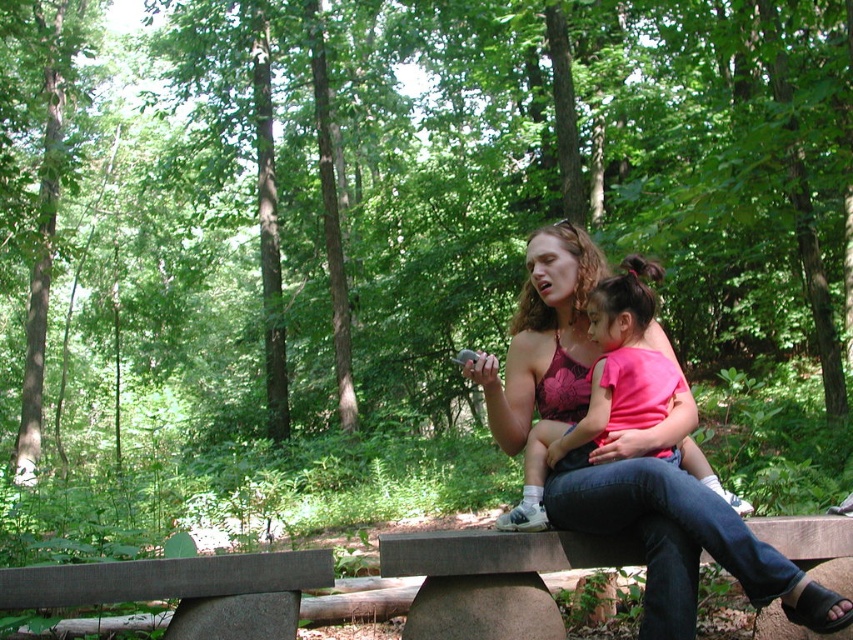
You are standing at the origin point in the image. Which direction should you move to reach the gray concrete bench at center?

The gray concrete bench at center is located at coordinates point (x=532, y=577), so you should move towards the right and forward to reach it.